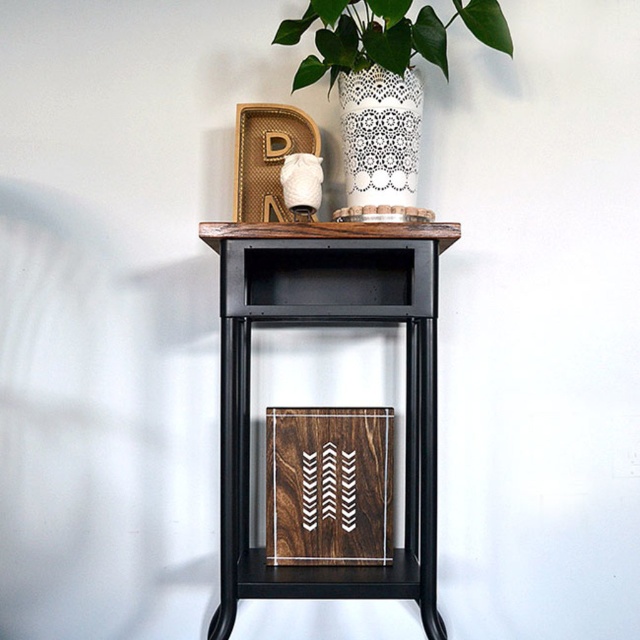
You are arranging flowers for a party and need to place them in the closest vase to you. Which of the two vases, the white lace vase at upper center or the white lace glass vase at upper center, should you choose?

The white lace vase at upper center is closer to the viewer, so you should choose the white lace vase at upper center.

You are organizing a dinner party and need to place a 12 inch long carving knife on the table. The knife must be placed on either the wooden cutting board at center or the white lace glass vase at upper center. Which object can accommodate the knife based on their widths?

The wooden cutting board at center has a greater width than the white lace glass vase at upper center, so the carving knife can be placed on the wooden cutting board at center.

You are arranging items on the side table and need to place a new item between the wooden cutting board at center and the white lace glass vase at upper center. Based on their current positions, where should you place the new item?

The wooden cutting board at center is positioned on the left side of the white lace glass vase at upper center, so you should place the new item between them to the right of the wooden cutting board at center and to the left of the white lace glass vase at upper center.